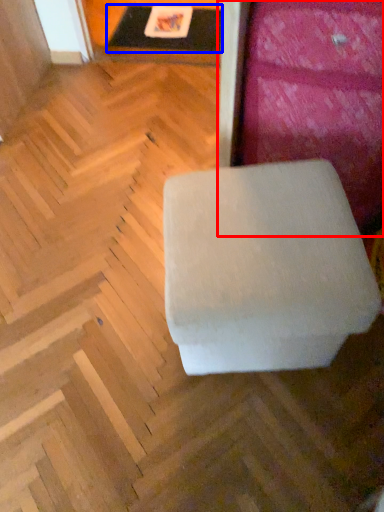
Question: Which object is closer to the camera taking this photo, furniture (highlighted by a red box) or table (highlighted by a blue box)?

Choices:
 (A) furniture
 (B) table

Answer: (A)